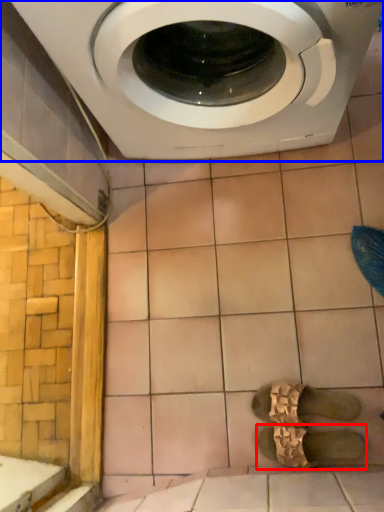
Question: Which object appears closest to the camera in this image, shoe (highlighted by a red box) or washing machine (highlighted by a blue box)?

Choices:
 (A) shoe
 (B) washing machine

Answer: (B)